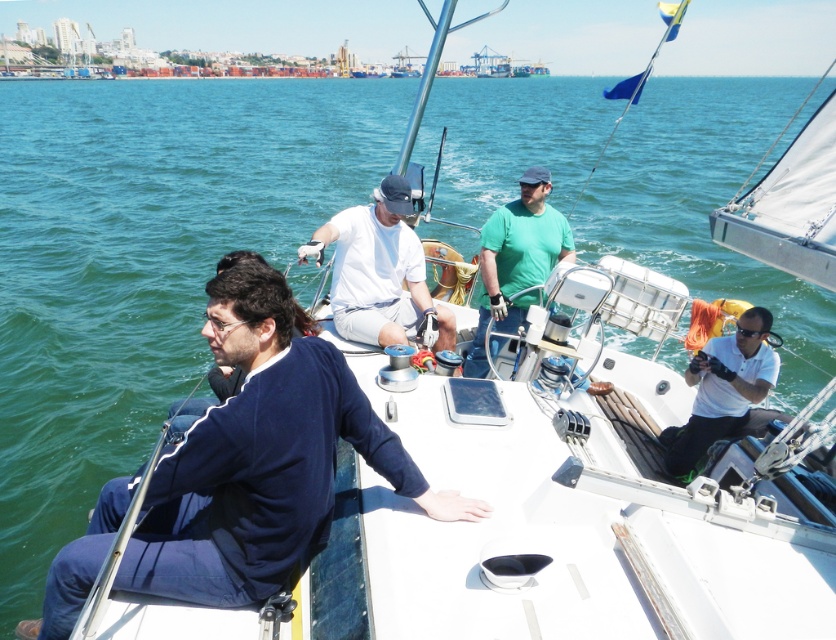
Which is more to the right, green matte shirt at center or white matte camera at right?

Positioned to the right is white matte camera at right.

Which is behind, point (544, 193) or point (735, 364)?

The point (544, 193) is more distant.

Is point (475, 372) positioned in front of point (705, 397)?

No.

The image size is (836, 640). What are the coordinates of `green matte shirt at center` in the screenshot? It's located at (516, 260).

Does point (347, 232) lie in front of point (483, 262)?

Yes, it is in front of point (483, 262).

Which is above, white matte shirt at center or green matte shirt at center?

green matte shirt at center

The image size is (836, 640). I want to click on white matte shirt at center, so click(x=381, y=272).

Who is lower down, white matte shirt at center or white matte camera at right?

white matte camera at right is lower down.

Can you confirm if white matte shirt at center is smaller than white matte camera at right?

Actually, white matte shirt at center might be larger than white matte camera at right.

Between point (454, 330) and point (707, 426), which one is positioned behind?

Point (454, 330)

Find the location of a particular element. This screenshot has height=640, width=836. white matte shirt at center is located at coordinates (381, 272).